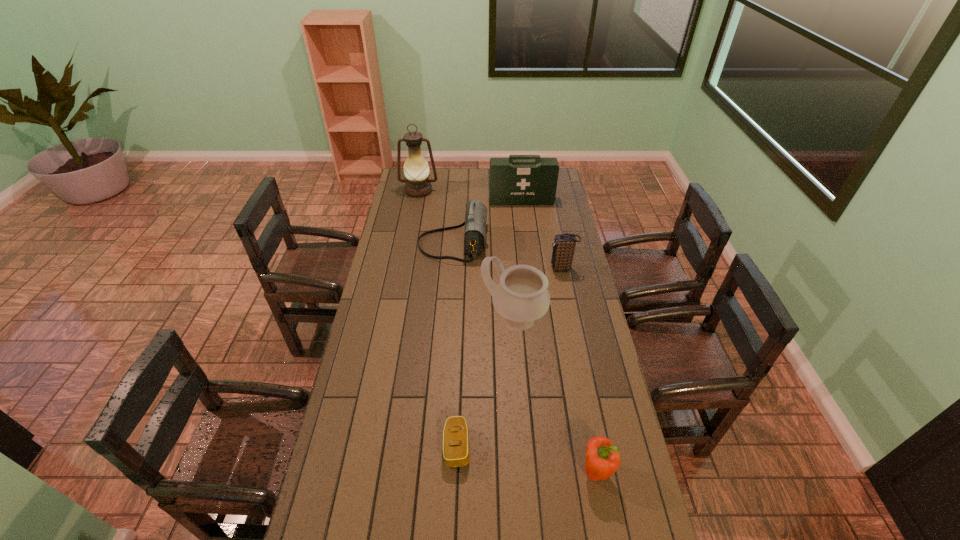
Identify the location of unoccupied position between the pepper and the tallest object. (507, 330).

What are the coordinates of `empty space between the tallest object and the second shortest object` in the screenshot? It's located at (507, 330).

This screenshot has height=540, width=960. Identify the location of free point between the shoulder bag and the tallest object. (436, 218).

You are a GUI agent. You are given a task and a screenshot of the screen. Output one action in this format:
    pyautogui.click(x=<x>, y=<y>)
    Task: Click on the vacant area between the first-aid kit and the shoulder bag
    The height and width of the screenshot is (540, 960).
    Given the screenshot: What is the action you would take?
    pyautogui.click(x=488, y=222)

Point out which object is positioned as the fourth nearest to the first-aid kit. Please provide its 2D coordinates. Your answer should be formatted as a tuple, i.e. [(x, y)], where the tuple contains the x and y coordinates of a point satisfying the conditions above.

[(521, 296)]

The image size is (960, 540). Find the location of `the second closest object to the oil lamp`. the second closest object to the oil lamp is located at coordinates (520, 179).

Where is `free spot that satisfies the following two spatial constraints: 1. on the back side of the second shortest object; 2. on the zipper side of the nearer clutch bag`? The width and height of the screenshot is (960, 540). free spot that satisfies the following two spatial constraints: 1. on the back side of the second shortest object; 2. on the zipper side of the nearer clutch bag is located at coordinates (591, 446).

I want to click on free space that satisfies the following two spatial constraints: 1. on the front-facing side of the second shortest object; 2. on the left side of the first-aid kit, so click(x=555, y=471).

This screenshot has width=960, height=540. Find the location of `blank space that satisfies the following two spatial constraints: 1. on the front side of the shoulder bag; 2. on the right side of the pottery`. blank space that satisfies the following two spatial constraints: 1. on the front side of the shoulder bag; 2. on the right side of the pottery is located at coordinates (448, 319).